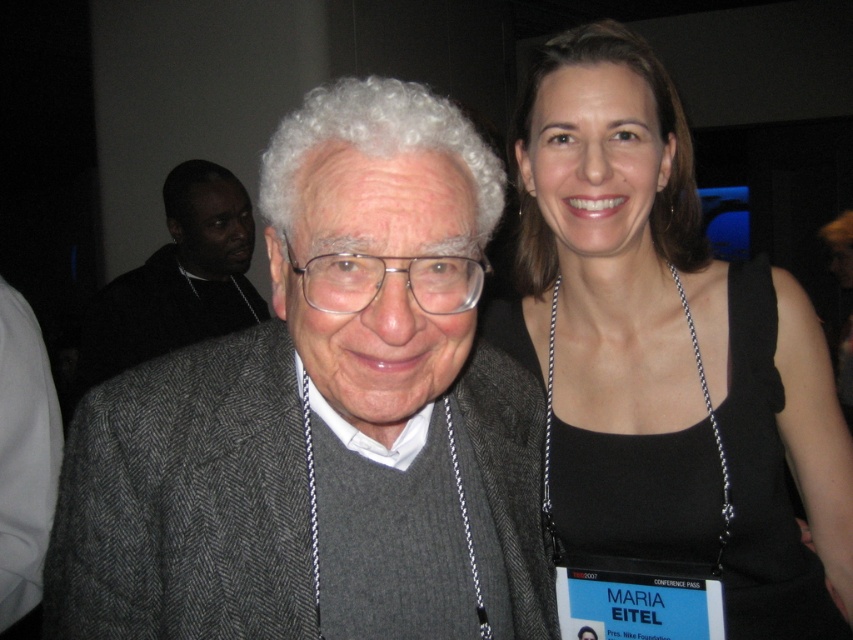
Is dark gray sweater at center to the left of silver chain necklace at upper right from the viewer's perspective?

Yes, dark gray sweater at center is to the left of silver chain necklace at upper right.

This screenshot has height=640, width=853. I want to click on dark gray sweater at center, so click(178, 278).

Is point (100, 364) in front of point (554, 291)?

No, it is behind (554, 291).

Locate an element on the screen. The height and width of the screenshot is (640, 853). dark gray sweater at center is located at coordinates (178, 278).

Between black fabric tank top at upper right and silver chain necklace at upper right, which one appears on the left side from the viewer's perspective?

silver chain necklace at upper right

Image resolution: width=853 pixels, height=640 pixels. Find the location of `black fabric tank top at upper right`. black fabric tank top at upper right is located at coordinates coord(666,349).

Does point (540, 310) come farther from viewer compared to point (555, 536)?

Yes, it is behind point (555, 536).

In order to click on black fabric tank top at upper right in this screenshot , I will do `click(666, 349)`.

Which is more to the left, black fabric tank top at upper right or dark gray sweater at center?

dark gray sweater at center is more to the left.

Can you confirm if black fabric tank top at upper right is shorter than dark gray sweater at center?

Result: In fact, black fabric tank top at upper right may be taller than dark gray sweater at center.

Where is `black fabric tank top at upper right`? The image size is (853, 640). black fabric tank top at upper right is located at coordinates (666, 349).